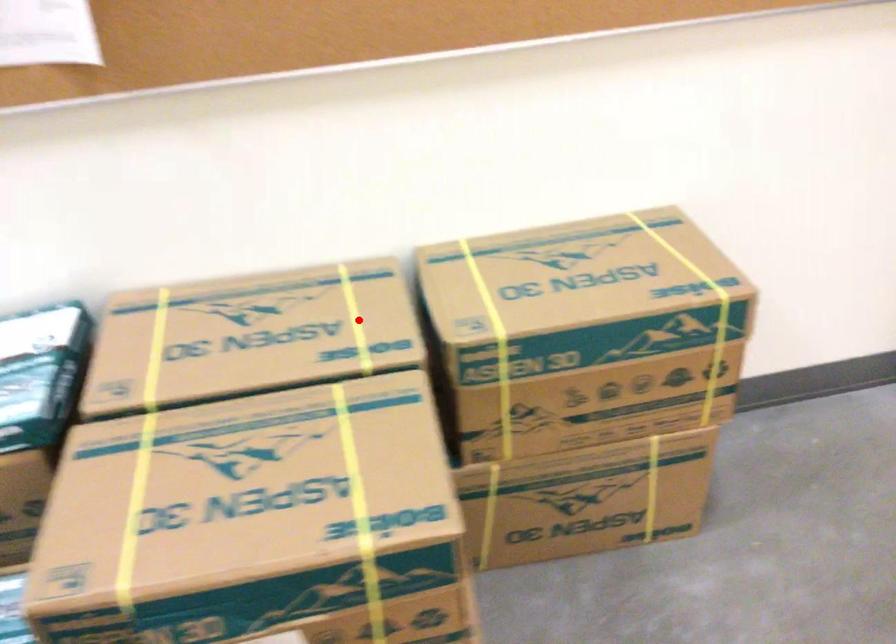
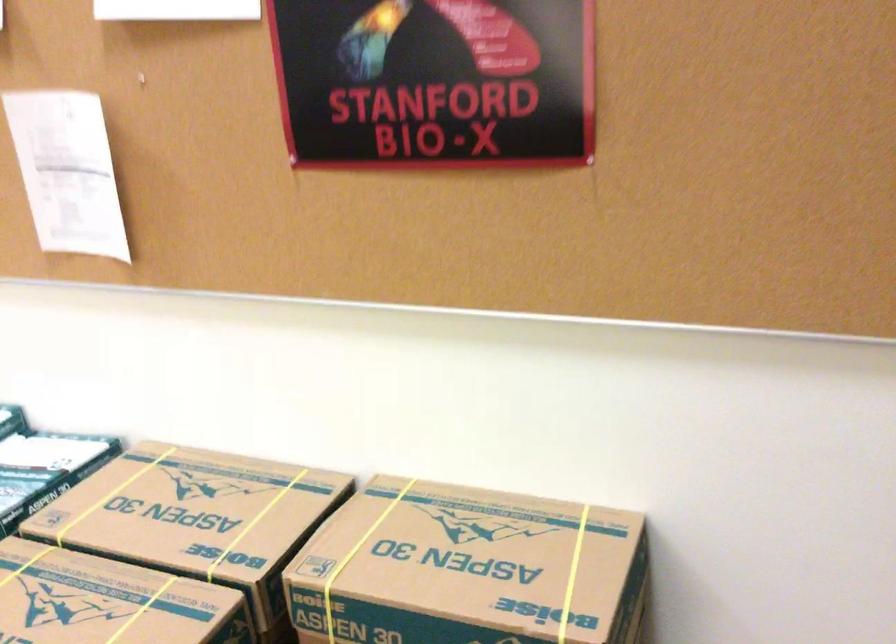
Find the pixel in the second image that matches the highlighted location in the first image.

(254, 523)